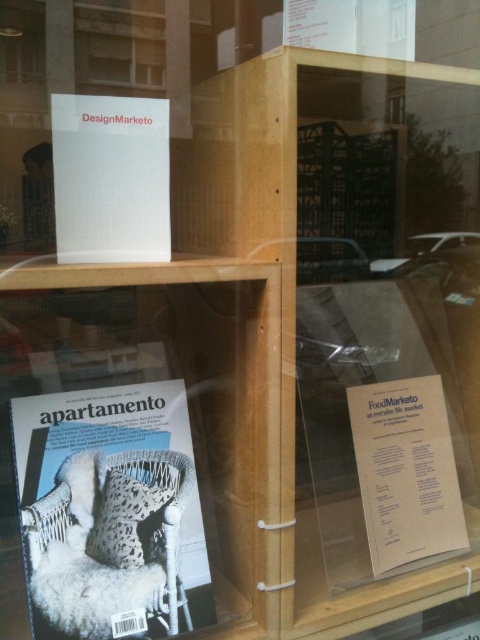
Question: Which point appears closest to the camera in this image?

Choices:
 (A) (99, 204)
 (B) (57, 408)

Answer: (A)

Question: Is white woven chair at lower left positioned at the back of white paper at upper center?

Choices:
 (A) no
 (B) yes

Answer: (B)

Question: Which point is farther to the camera?

Choices:
 (A) (113, 147)
 (B) (34, 454)

Answer: (B)

Question: Does white woven chair at lower left have a larger size compared to white paper at upper center?

Choices:
 (A) yes
 (B) no

Answer: (A)

Question: Is white woven chair at lower left wider than white paper at upper center?

Choices:
 (A) yes
 (B) no

Answer: (A)